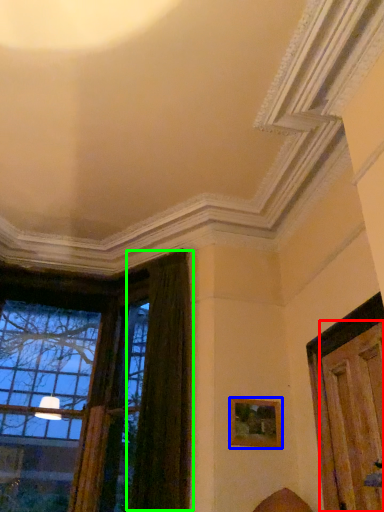
Question: Based on their relative distances, which object is nearer to door (highlighted by a red box)? Choose from picture frame (highlighted by a blue box) and curtain (highlighted by a green box).

Choices:
 (A) picture frame
 (B) curtain

Answer: (A)